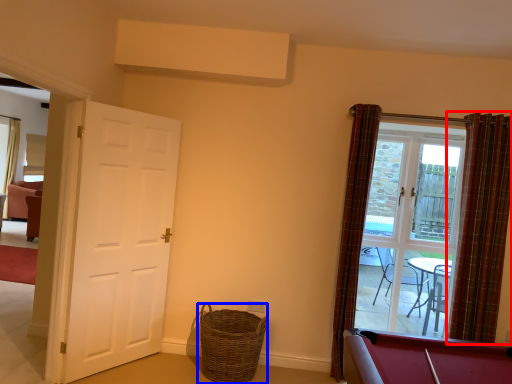
Question: Among these objects, which one is farthest to the camera, curtain (highlighted by a red box) or basket (highlighted by a blue box)?

Choices:
 (A) curtain
 (B) basket

Answer: (A)